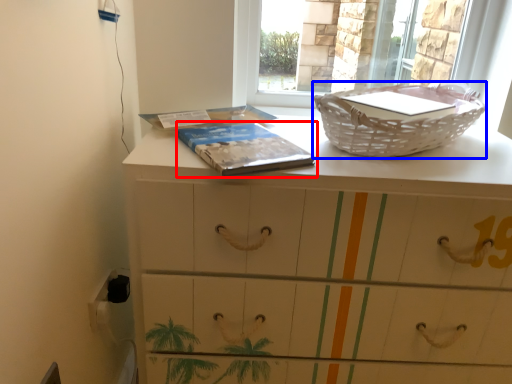
Question: Which point is further to the camera, paperback book (highlighted by a red box) or basket container (highlighted by a blue box)?

Choices:
 (A) paperback book
 (B) basket container

Answer: (B)